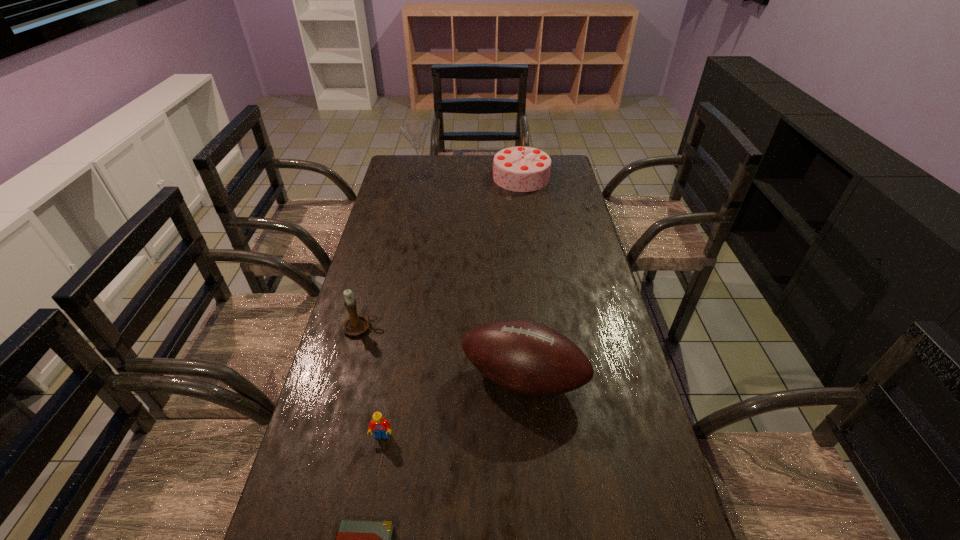
Locate an element on the screen. the tallest object is located at coordinates (416, 132).

Image resolution: width=960 pixels, height=540 pixels. I want to click on birthday cake, so click(x=522, y=169).

The height and width of the screenshot is (540, 960). What are the coordinates of `the fourth farthest object` in the screenshot? It's located at (526, 357).

Where is `the third farthest object`? the third farthest object is located at coordinates (355, 325).

This screenshot has width=960, height=540. In order to click on the third shortest object in this screenshot , I will do `click(355, 325)`.

Image resolution: width=960 pixels, height=540 pixels. In order to click on the fifth farthest object in this screenshot , I will do `click(381, 427)`.

This screenshot has width=960, height=540. I want to click on the fifth tallest object, so click(x=381, y=427).

You are a GUI agent. You are given a task and a screenshot of the screen. Output one action in this format:
    pyautogui.click(x=<x>, y=<y>)
    Task: Click on the free point located on the front of the flute glass
    The image size is (960, 540).
    Given the screenshot: What is the action you would take?
    pyautogui.click(x=411, y=225)

At what (x,y) coordinates should I click in order to perform the action: click on free region located on the front of the birthday cake. Please return your answer as a coordinate pair (x, y). Looking at the image, I should click on (527, 219).

Identify the location of free space located 0.270m on the left of the football (American). The width and height of the screenshot is (960, 540). (357, 378).